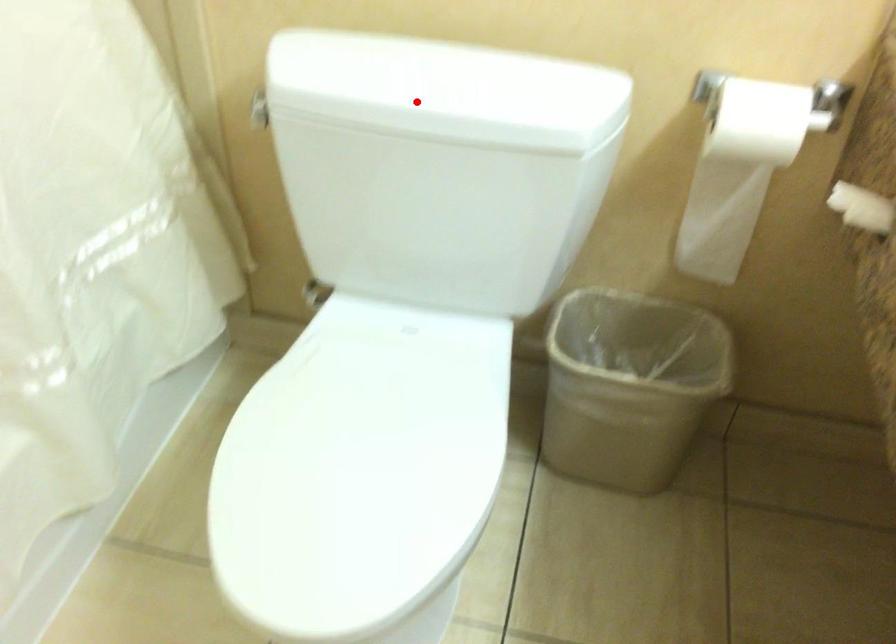
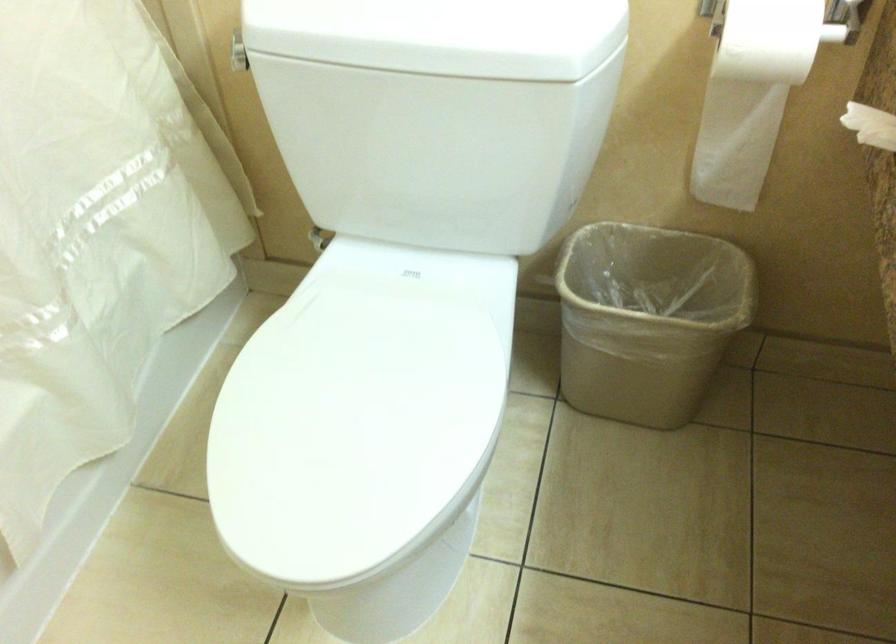
Locate, in the second image, the point that corresponds to the highlighted location in the first image.

(393, 35)